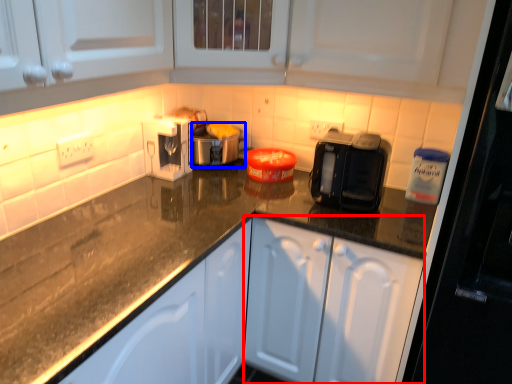
Question: Which object appears closest to the camera in this image, cabinetry (highlighted by a red box) or appliance (highlighted by a blue box)?

Choices:
 (A) cabinetry
 (B) appliance

Answer: (A)